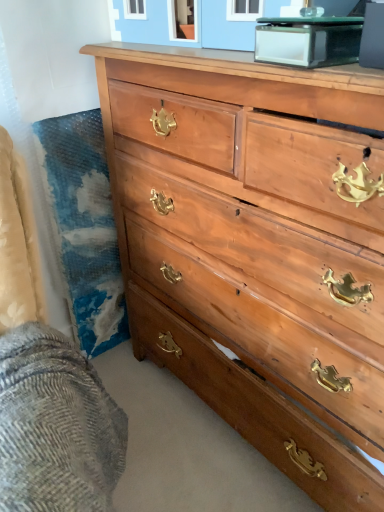
I want to click on woolen fabric at lower left, so click(55, 426).

Measure the distance between light brown wood chest of drawers at center and camera.

21.21 inches.

Find the location of `clear glass table at upper center`. clear glass table at upper center is located at coordinates (308, 40).

The width and height of the screenshot is (384, 512). I want to click on woolen fabric at lower left, so click(x=55, y=426).

Is clear glass table at upper center oriented towards light brown wood chest of drawers at center?

No, clear glass table at upper center is not oriented towards light brown wood chest of drawers at center.

How far apart are clear glass table at upper center and light brown wood chest of drawers at center?

16.00 inches.

Is point (280, 63) positioned in front of point (199, 386)?

Yes, it is.

Is clear glass table at upper center wider than light brown wood chest of drawers at center?

No.

Considering the sizes of light brown wood chest of drawers at center and woolen fabric at lower left in the image, is light brown wood chest of drawers at center taller or shorter than woolen fabric at lower left?

Clearly, light brown wood chest of drawers at center is taller compared to woolen fabric at lower left.

Between light brown wood chest of drawers at center and woolen fabric at lower left, which one is positioned behind?

light brown wood chest of drawers at center is further from the camera.

Considering the sizes of objects light brown wood chest of drawers at center and woolen fabric at lower left in the image provided, who is thinner, light brown wood chest of drawers at center or woolen fabric at lower left?

woolen fabric at lower left.

Could you tell me if light brown wood chest of drawers at center is turned towards woolen fabric at lower left?

Yes, light brown wood chest of drawers at center faces towards woolen fabric at lower left.

Which object is positioned more to the right, woolen fabric at lower left or light brown wood chest of drawers at center?

From the viewer's perspective, light brown wood chest of drawers at center appears more on the right side.

From a real-world perspective, is woolen fabric at lower left below light brown wood chest of drawers at center?

Yes.

Which point is more forward, (x=81, y=361) or (x=125, y=262)?

The point (x=81, y=361) is closer.

Which is behind, clear glass table at upper center or woolen fabric at lower left?

clear glass table at upper center is further away from the camera.

Looking at this image, is clear glass table at upper center surrounding woolen fabric at lower left?

No, woolen fabric at lower left is not a part of clear glass table at upper center.

How different are the orientations of clear glass table at upper center and woolen fabric at lower left in degrees?

The angular difference between clear glass table at upper center and woolen fabric at lower left is 70.2 degrees.

Considering the sizes of objects clear glass table at upper center and woolen fabric at lower left in the image provided, who is thinner, clear glass table at upper center or woolen fabric at lower left?

clear glass table at upper center is thinner.

Is woolen fabric at lower left completely or partially outside of clear glass table at upper center?

Absolutely, woolen fabric at lower left is external to clear glass table at upper center.

Which object is positioned more to the right, woolen fabric at lower left or clear glass table at upper center?

clear glass table at upper center is more to the right.

Can you tell me how much woolen fabric at lower left and clear glass table at upper center differ in facing direction?

There is a 70.2-degree angle between the facing directions of woolen fabric at lower left and clear glass table at upper center.

Is woolen fabric at lower left oriented away from clear glass table at upper center?

That's not correct — woolen fabric at lower left is not looking away from clear glass table at upper center.

Between light brown wood chest of drawers at center and clear glass table at upper center, which one appears on the left side from the viewer's perspective?

From the viewer's perspective, clear glass table at upper center appears more on the left side.

Considering the positions of objects light brown wood chest of drawers at center and clear glass table at upper center in the image provided, who is behind, light brown wood chest of drawers at center or clear glass table at upper center?

clear glass table at upper center.

Between light brown wood chest of drawers at center and clear glass table at upper center, which one has more height?

With more height is light brown wood chest of drawers at center.

Identify the location of cabinetry that appears behind the light brown wood chest of drawers at center. This screenshot has width=384, height=512. (308, 40).

This screenshot has height=512, width=384. I want to click on the chest of drawers in front of the clear glass table at upper center, so [x=255, y=251].

The width and height of the screenshot is (384, 512). Find the location of `the chest of drawers that is above the woolen fabric at lower left (from the image's perspective)`. the chest of drawers that is above the woolen fabric at lower left (from the image's perspective) is located at coordinates (255, 251).

Based on their spatial positions, is woolen fabric at lower left or clear glass table at upper center further from light brown wood chest of drawers at center?

The object further to light brown wood chest of drawers at center is woolen fabric at lower left.

Based on the photo, estimate the real-world distances between objects in this image. Which object is closer to light brown wood chest of drawers at center, clear glass table at upper center or woolen fabric at lower left?

clear glass table at upper center is closer to light brown wood chest of drawers at center.

Looking at the image, which one is located further to woolen fabric at lower left, light brown wood chest of drawers at center or clear glass table at upper center?

clear glass table at upper center lies further to woolen fabric at lower left than the other object.

Which object lies further to the anchor point clear glass table at upper center, woolen fabric at lower left or light brown wood chest of drawers at center?

woolen fabric at lower left lies further to clear glass table at upper center than the other object.

From the image, which object appears to be nearer to clear glass table at upper center, light brown wood chest of drawers at center or woolen fabric at lower left?

light brown wood chest of drawers at center is closer to clear glass table at upper center.

When comparing their distances from woolen fabric at lower left, does clear glass table at upper center or light brown wood chest of drawers at center seem closer?

Among the two, light brown wood chest of drawers at center is located nearer to woolen fabric at lower left.

At what (x,y) coordinates should I click in order to perform the action: click on the chest of drawers that lies between clear glass table at upper center and woolen fabric at lower left from top to bottom. Please return your answer as a coordinate pair (x, y). This screenshot has width=384, height=512. Looking at the image, I should click on (255, 251).